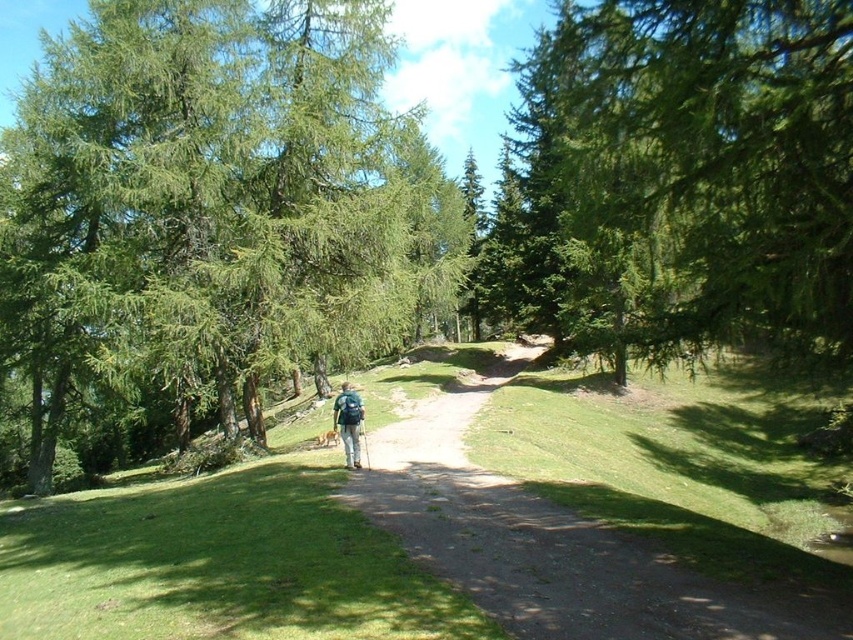
Question: Does green needle-like tree at center have a larger size compared to green textured tree at upper center?

Choices:
 (A) yes
 (B) no

Answer: (A)

Question: Is green needle-like tree at center below green fabric backpack at center?

Choices:
 (A) no
 (B) yes

Answer: (A)

Question: Which of the following is the closest to the observer?

Choices:
 (A) green needle-like tree at center
 (B) green fabric backpack at center
 (C) dirt path at center

Answer: (C)

Question: Where is green needle-like tree at center located in relation to green fabric backpack at center in the image?

Choices:
 (A) right
 (B) left

Answer: (B)

Question: Which point appears farthest from the camera in this image?

Choices:
 (A) (550, 218)
 (B) (0, 364)

Answer: (A)

Question: Among these points, which one is farthest from the camera?

Choices:
 (A) (436, 460)
 (B) (694, 48)
 (C) (357, 16)
 (D) (352, 465)

Answer: (C)